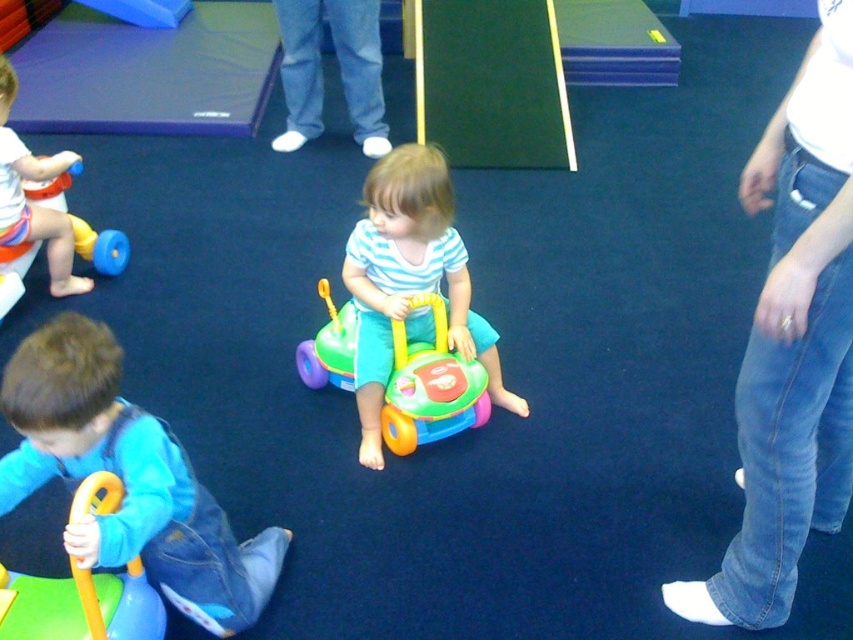
Question: Observing the image, what is the correct spatial positioning of blue denim jacket at lower left in reference to rubber yellow walker at lower left?

Choices:
 (A) right
 (B) left

Answer: (B)

Question: Estimate the real-world distances between objects in this image. Which object is farther from the matte plastic toy at left?

Choices:
 (A) blue denim jacket at lower left
 (B) multicolored plastic walker at center

Answer: (A)

Question: Does striped cotton shirt at center appear over multicolored plastic walker at center?

Choices:
 (A) yes
 (B) no

Answer: (A)

Question: Does multicolored plastic walker at center have a smaller size compared to rubber yellow walker at lower left?

Choices:
 (A) no
 (B) yes

Answer: (A)

Question: Based on their relative distances, which object is farther from the rubber yellow walker at lower left?

Choices:
 (A) blue denim jacket at lower left
 (B) matte plastic toy at left

Answer: (B)

Question: Which point is closer to the camera?

Choices:
 (A) blue denim jacket at lower left
 (B) striped cotton shirt at center

Answer: (A)